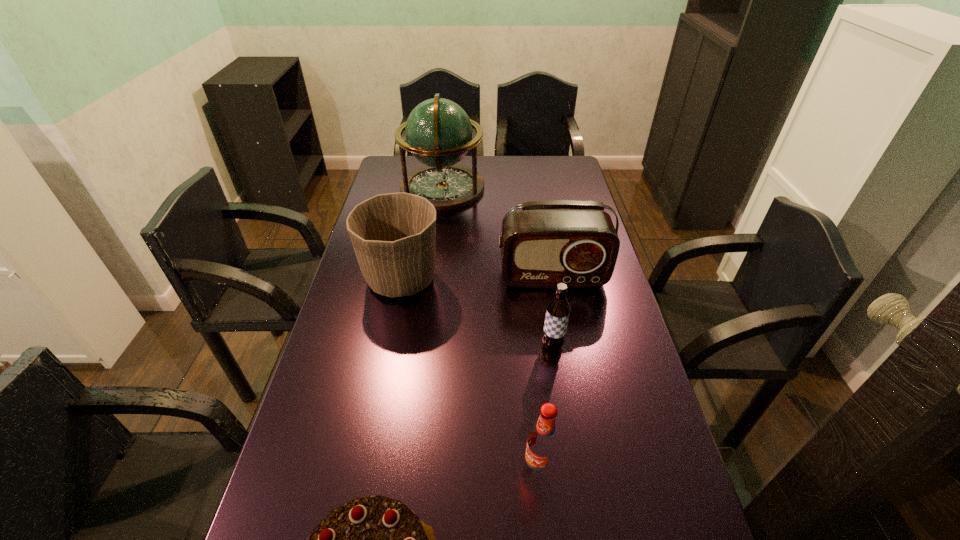
The width and height of the screenshot is (960, 540). Find the location of `object that is the fifth closest to the nearest object`. object that is the fifth closest to the nearest object is located at coordinates (438, 132).

Locate an element on the screen. The height and width of the screenshot is (540, 960). object that is the third closest to the fifth farthest object is located at coordinates (393, 235).

I want to click on vacant point that satisfies the following two spatial constraints: 1. on the front-facing side of the tallest object; 2. on the right side of the third nearest object, so click(x=423, y=346).

Identify the location of vacant space that satisfies the following two spatial constraints: 1. on the front-facing side of the farthest object; 2. on the left side of the fourth farthest object. The width and height of the screenshot is (960, 540). (423, 346).

Image resolution: width=960 pixels, height=540 pixels. In order to click on vacant space that satisfies the following two spatial constraints: 1. on the back side of the left root beer; 2. on the front-facing side of the globe in this screenshot , I will do `click(511, 187)`.

Locate an element on the screen. This screenshot has width=960, height=540. free spot that satisfies the following two spatial constraints: 1. on the back side of the fourth farthest object; 2. on the front-facing side of the globe is located at coordinates (528, 187).